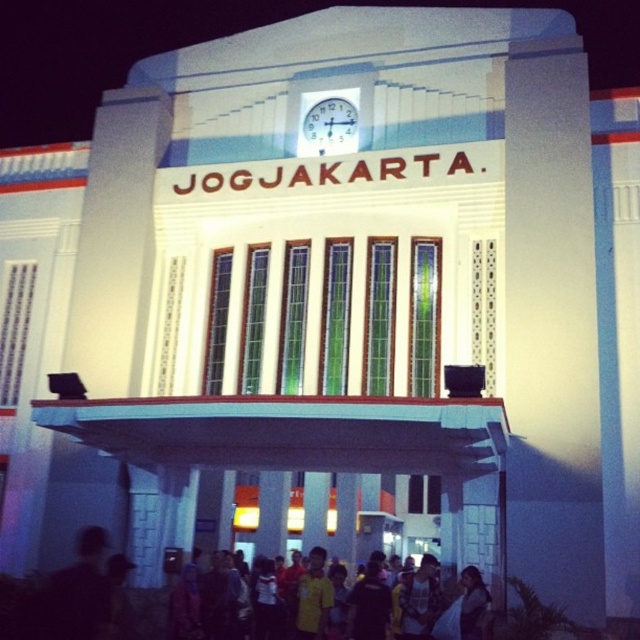
Question: Among these points, which one is farthest from the camera?

Choices:
 (A) (474, 573)
 (B) (316, 141)

Answer: (B)

Question: Among these objects, which one is nearest to the camera?

Choices:
 (A) yellow shirt at lower center
 (B) white plastic clock at upper center

Answer: (A)

Question: Does yellow shirt at lower center have a larger size compared to white plastic clock at upper center?

Choices:
 (A) yes
 (B) no

Answer: (A)

Question: Can you confirm if yellow shirt at lower center is thinner than white plastic clock at upper center?

Choices:
 (A) no
 (B) yes

Answer: (A)

Question: Does yellow shirt at lower center appear over white plastic clock at upper center?

Choices:
 (A) yes
 (B) no

Answer: (B)